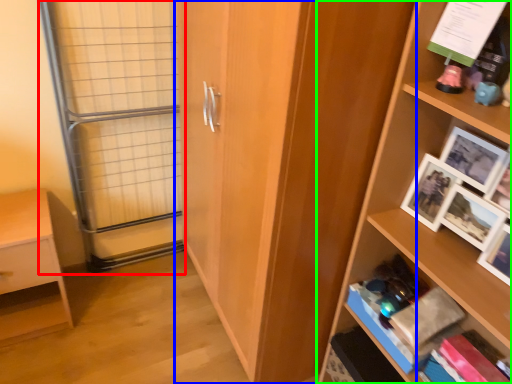
Question: Which is farther away from glass door (highlighted by a red box)? cupboard (highlighted by a blue box) or shelf (highlighted by a green box)?

Choices:
 (A) cupboard
 (B) shelf

Answer: (B)